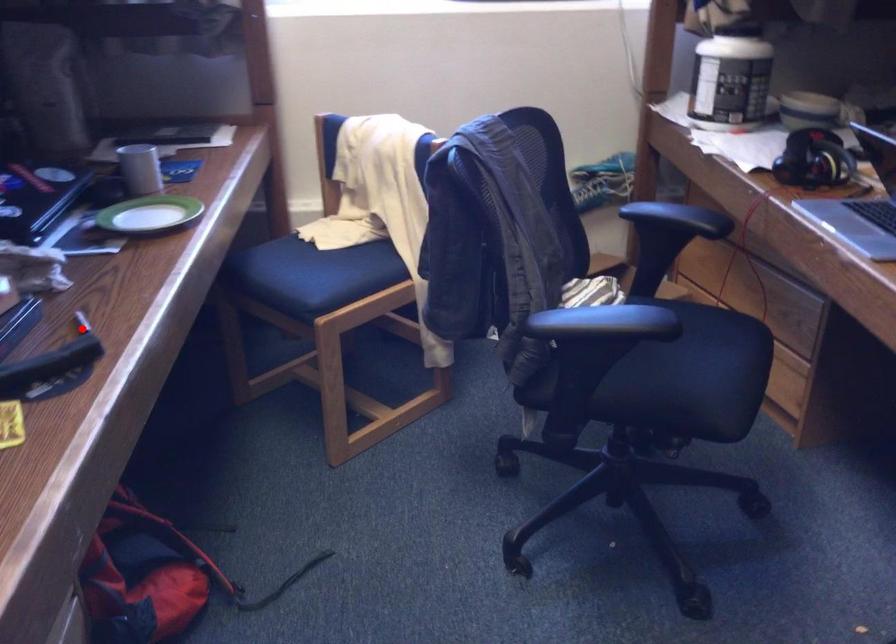
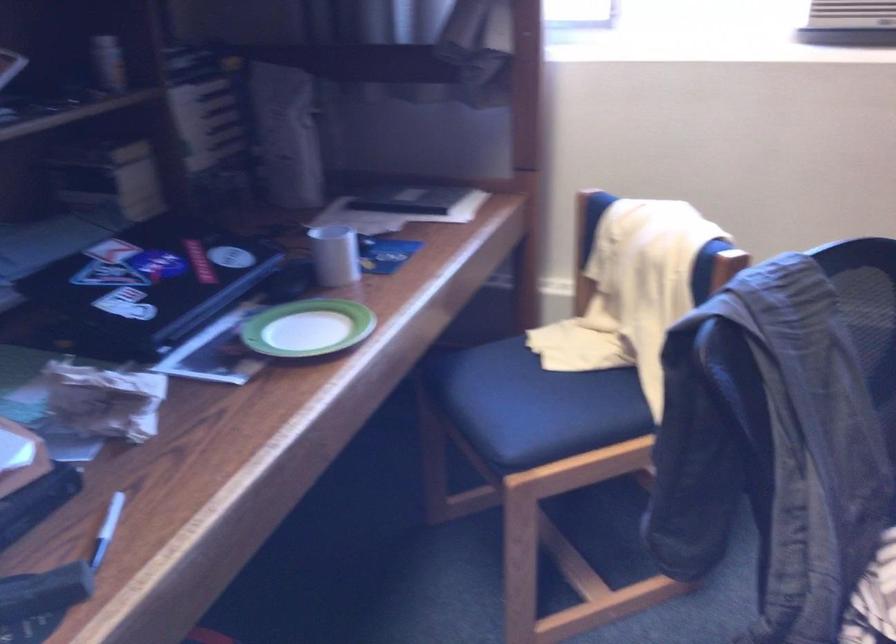
Question: I am providing you with two images of the same scene from different viewpoints. Image1 has a red point marked. In image2, the corresponding 3D location appears at what relative position? Reply with the corresponding letter.

Choices:
 (A) Closer
 (B) Farther

Answer: (A)